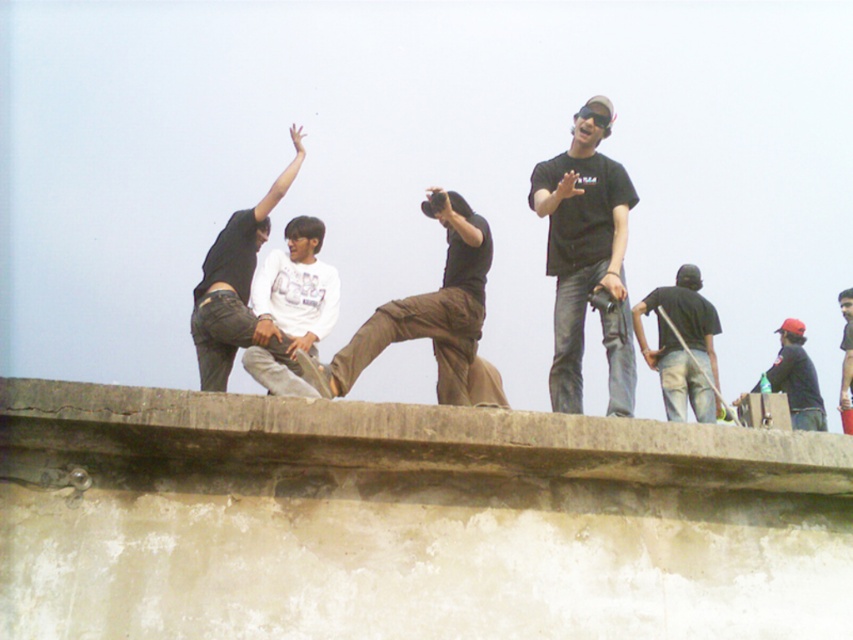
Consider the image. Can you confirm if brown cotton pants at center is positioned above dark gray jeans at right?

Correct, brown cotton pants at center is located above dark gray jeans at right.

Can you confirm if brown cotton pants at center is positioned to the left of dark gray jeans at right?

Correct, you'll find brown cotton pants at center to the left of dark gray jeans at right.

Between point (426, 330) and point (636, 312), which one is positioned in front?

Point (426, 330) is more forward.

Locate an element on the screen. This screenshot has width=853, height=640. brown cotton pants at center is located at coordinates [428, 308].

Does black matte shirt at upper center have a lesser height compared to white matte shirt at center?

In fact, black matte shirt at upper center may be taller than white matte shirt at center.

Describe the element at coordinates (585, 257) in the screenshot. I see `black matte shirt at upper center` at that location.

Who is more forward, (564, 300) or (256, 352)?

Point (256, 352) is more forward.

Image resolution: width=853 pixels, height=640 pixels. I want to click on black matte shirt at upper center, so click(585, 257).

Does white matte shirt at center appear on the right side of dark gray jeans at right?

In fact, white matte shirt at center is to the left of dark gray jeans at right.

Looking at this image, which is above, white matte shirt at center or dark gray jeans at right?

white matte shirt at center is higher up.

Find the location of a particular element. Image resolution: width=853 pixels, height=640 pixels. white matte shirt at center is located at coordinates (297, 288).

Find the location of a particular element. The width and height of the screenshot is (853, 640). white matte shirt at center is located at coordinates (297, 288).